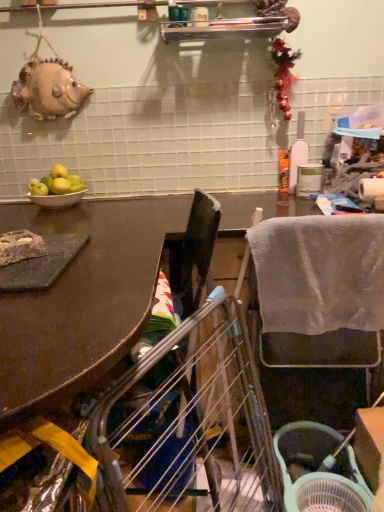
Question: Is brown matte table at upper left turned away from white ceramic bowl at left?

Choices:
 (A) yes
 (B) no

Answer: (B)

Question: Considering the relative sizes of brown matte table at upper left and white ceramic bowl at left in the image provided, is brown matte table at upper left bigger than white ceramic bowl at left?

Choices:
 (A) yes
 (B) no

Answer: (A)

Question: Is the position of brown matte table at upper left less distant than that of white ceramic bowl at left?

Choices:
 (A) no
 (B) yes

Answer: (B)

Question: Does brown matte table at upper left turn towards white ceramic bowl at left?

Choices:
 (A) no
 (B) yes

Answer: (A)

Question: Is there a large distance between brown matte table at upper left and white ceramic bowl at left?

Choices:
 (A) yes
 (B) no

Answer: (B)

Question: In terms of height, does green matte apples at left look taller or shorter compared to white ceramic bowl at left?

Choices:
 (A) tall
 (B) short

Answer: (A)

Question: From a real-world perspective, is green matte apples at left above or below white ceramic bowl at left?

Choices:
 (A) above
 (B) below

Answer: (A)

Question: Looking at the image, does green matte apples at left seem bigger or smaller compared to white ceramic bowl at left?

Choices:
 (A) big
 (B) small

Answer: (A)

Question: Does point (61, 167) appear closer or farther from the camera than point (66, 205)?

Choices:
 (A) farther
 (B) closer

Answer: (A)

Question: Would you say metallic silver shelf at upper center is to the left or to the right of brown matte table at upper left in the picture?

Choices:
 (A) right
 (B) left

Answer: (B)

Question: From the image's perspective, is metallic silver shelf at upper center located above or below brown matte table at upper left?

Choices:
 (A) below
 (B) above

Answer: (B)

Question: Considering the positions of metallic silver shelf at upper center and brown matte table at upper left in the image, is metallic silver shelf at upper center bigger or smaller than brown matte table at upper left?

Choices:
 (A) small
 (B) big

Answer: (A)

Question: Is point (173, 27) closer or farther from the camera than point (140, 307)?

Choices:
 (A) closer
 (B) farther

Answer: (B)

Question: From the image's perspective, relative to white ceramic bowl at left, is green plastic basket at lower right above or below?

Choices:
 (A) below
 (B) above

Answer: (A)

Question: Choose the correct answer: Is green plastic basket at lower right inside white ceramic bowl at left or outside it?

Choices:
 (A) inside
 (B) outside

Answer: (B)